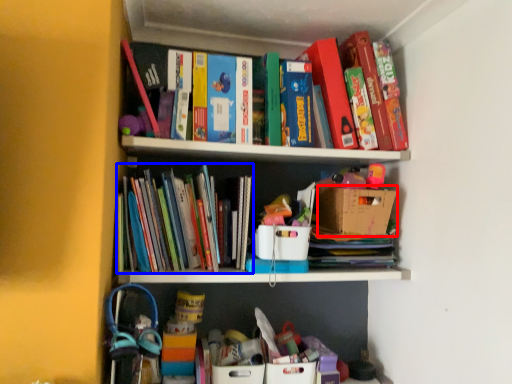
Question: Which object is further to the camera taking this photo, cardboard box (highlighted by a red box) or book (highlighted by a blue box)?

Choices:
 (A) cardboard box
 (B) book

Answer: (A)